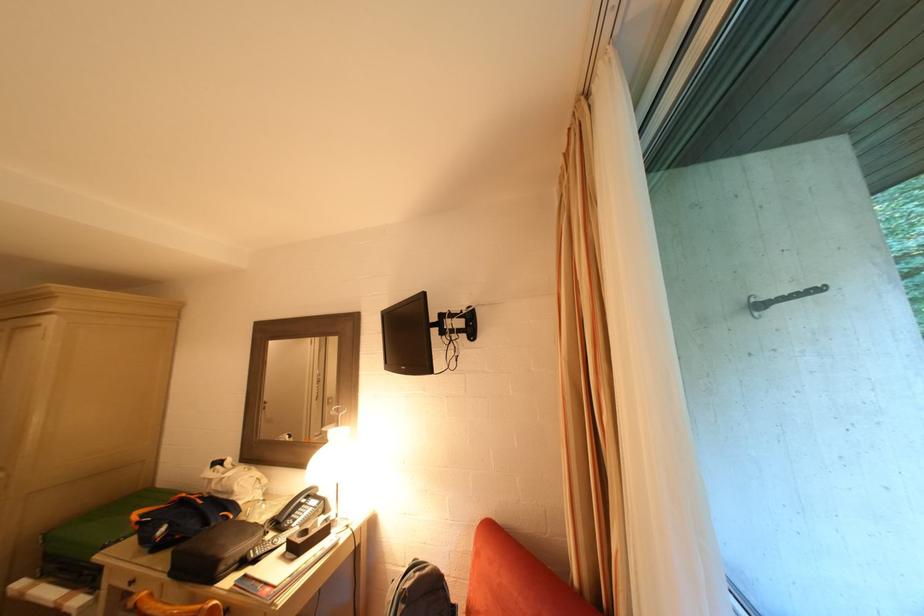
The height and width of the screenshot is (616, 924). What do you see at coordinates (586, 399) in the screenshot? I see `the white sheer curtain` at bounding box center [586, 399].